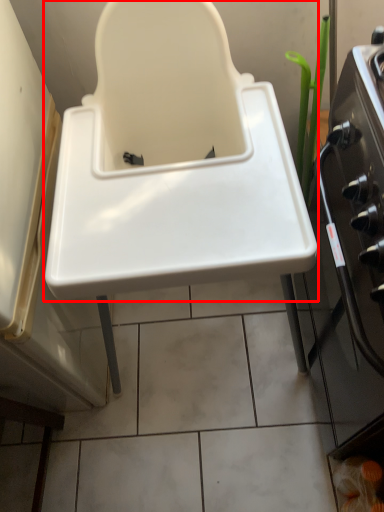
Question: Where is sink (annotated by the red box) located in relation to oven in the image?

Choices:
 (A) left
 (B) right

Answer: (A)